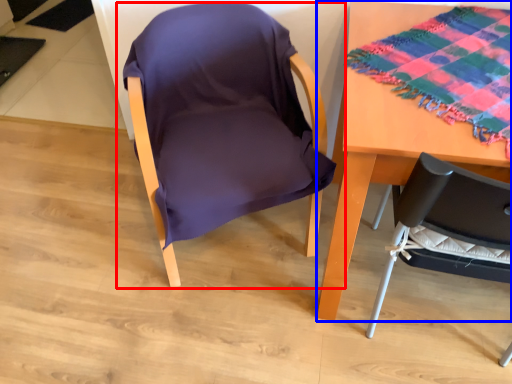
Question: Which object is further to the camera taking this photo, chair (highlighted by a red box) or table (highlighted by a blue box)?

Choices:
 (A) chair
 (B) table

Answer: (A)